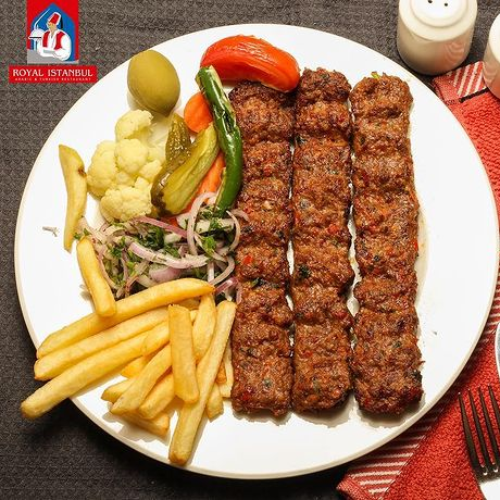
Find the location of a particular element. This screenshot has width=500, height=500. salt and pepper shakers is located at coordinates (449, 5), (492, 60).